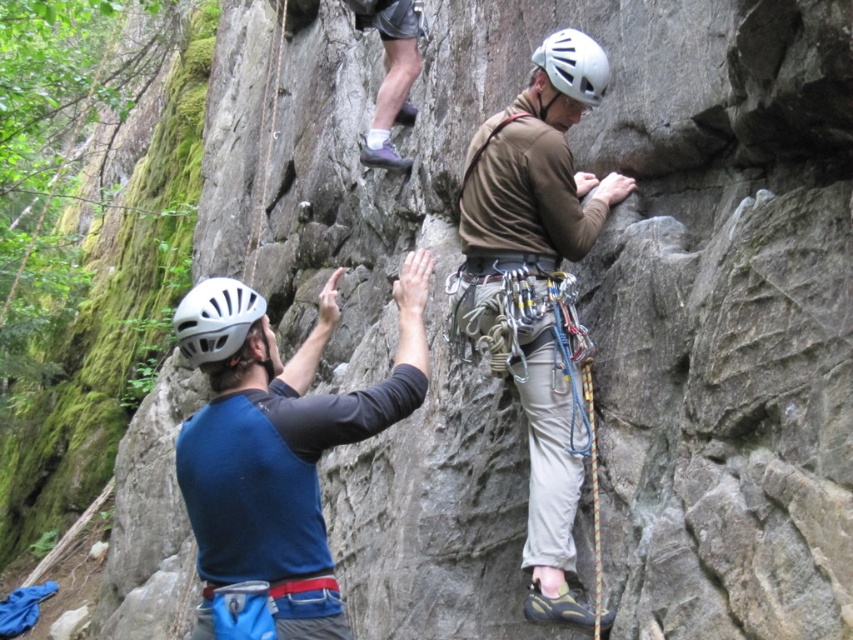
You are a photographer standing at the base of the rock face. You want to take a photo that includes both the climber in the foreground and the one higher up. Which of the two points, point (202, 419) or point (206, 301), is closer to the camera to ensure both climbers are in frame?

Point (206, 301) is closer to the camera since it is less further than point (202, 419), ensuring both climbers are within the frame.

You are a rock climber who needs to retrieve your rope at upper center. The blue fabric shirt at center belongs to your teammate. Which direction should you move to reach the rope without disturbing your teammate?

The blue fabric shirt at center is to the right of the rope at upper center, so you should move to the left to reach the rope at upper center without disturbing your teammate.